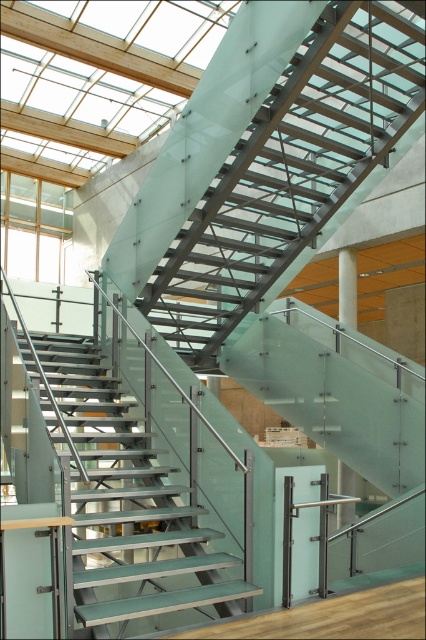
Who is lower down, green glass stairs at center or white glossy pillar at center?

green glass stairs at center is below.

Is green glass stairs at center further to the viewer compared to white glossy pillar at center?

No, green glass stairs at center is closer to the viewer.

Is point (175, 534) farther from viewer compared to point (347, 248)?

No, it is in front of (347, 248).

At what (x,y) coordinates should I click in order to perform the action: click on green glass stairs at center. Please return your answer as a coordinate pair (x, y). Looking at the image, I should click on (131, 509).